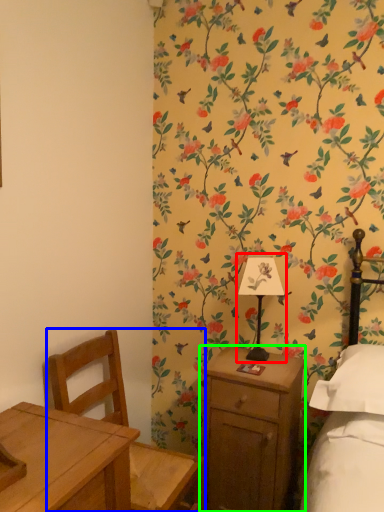
Question: Which object is the closest to the bedside lamp (highlighted by a red box)? Choose among these: chair (highlighted by a blue box) or nightstand (highlighted by a green box).

Choices:
 (A) chair
 (B) nightstand

Answer: (B)